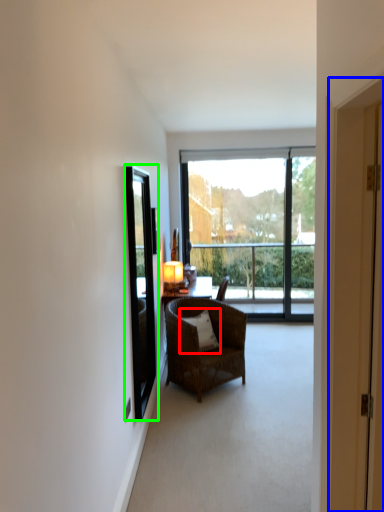
Question: Which object is the farthest from pillow (highlighted by a red box)? Choose among these: door (highlighted by a blue box) or window screen (highlighted by a green box).

Choices:
 (A) door
 (B) window screen

Answer: (A)